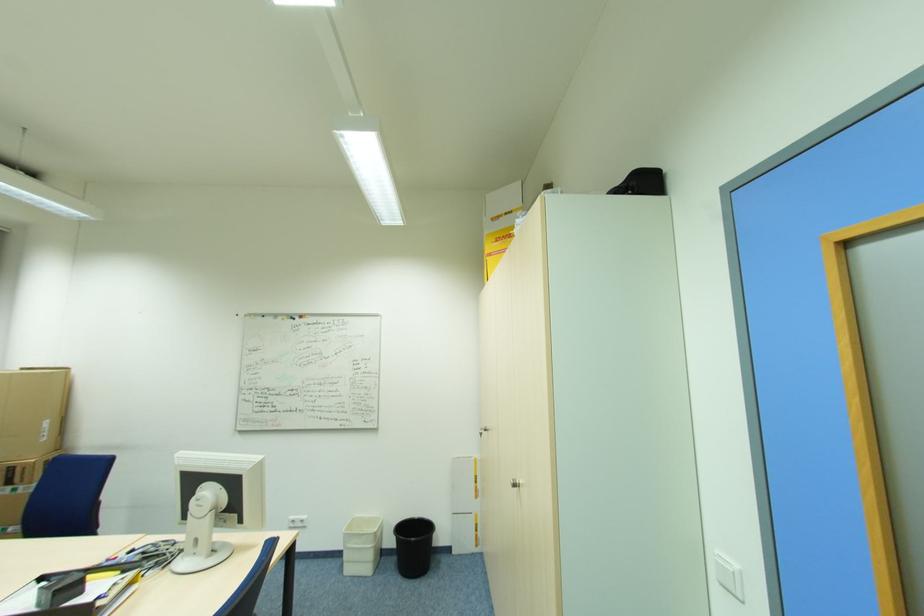
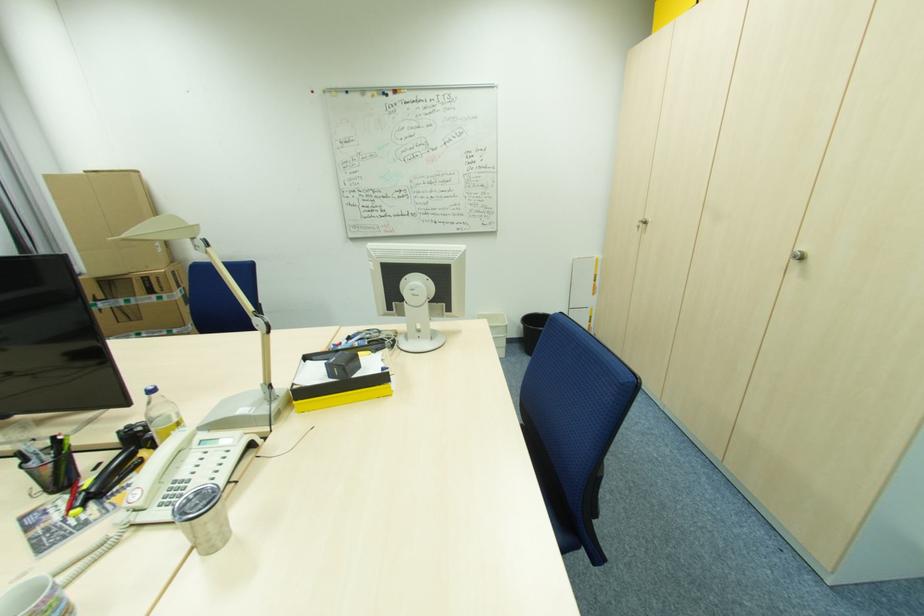
Question: In a continuous first-person perspective shot, in which direction is the camera moving?

Choices:
 (A) Left
 (B) Right
 (C) Forward
 (D) Backward

Answer: (A)